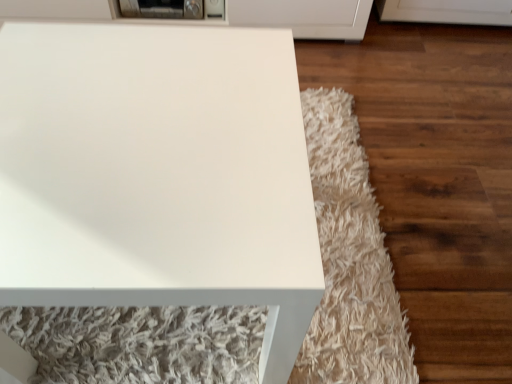
Describe the element at coordinates (157, 173) in the screenshot. The width and height of the screenshot is (512, 384). I see `white glossy table at center` at that location.

Image resolution: width=512 pixels, height=384 pixels. In order to click on white glossy table at center in this screenshot , I will do `click(157, 173)`.

Measure the distance between white glossy table at center and camera.

white glossy table at center is 19.07 inches from camera.

What do you see at coordinates (170, 9) in the screenshot? The width and height of the screenshot is (512, 384). I see `metallic gray toaster at upper center` at bounding box center [170, 9].

You are a GUI agent. You are given a task and a screenshot of the screen. Output one action in this format:
    pyautogui.click(x=<x>, y=<y>)
    Task: Click on the metallic gray toaster at upper center
    
    Given the screenshot: What is the action you would take?
    pyautogui.click(x=170, y=9)

You are a GUI agent. You are given a task and a screenshot of the screen. Output one action in this format:
    pyautogui.click(x=<x>, y=<y>)
    Task: Click on the white glossy table at center
    
    Given the screenshot: What is the action you would take?
    pyautogui.click(x=157, y=173)

Considering the positions of objects metallic gray toaster at upper center and white glossy table at center in the image provided, who is more to the right, metallic gray toaster at upper center or white glossy table at center?

white glossy table at center is more to the right.

Which object is closer to the camera taking this photo, metallic gray toaster at upper center or white glossy table at center?

Positioned in front is white glossy table at center.

Which is behind, point (139, 3) or point (104, 264)?

Positioned behind is point (139, 3).

From the image's perspective, is metallic gray toaster at upper center on white glossy table at center?

Indeed, from the image's perspective, metallic gray toaster at upper center is shown above white glossy table at center.

From a real-world perspective, is metallic gray toaster at upper center positioned over white glossy table at center based on gravity?

Actually, metallic gray toaster at upper center is physically below white glossy table at center in the real world.

Can you confirm if metallic gray toaster at upper center is thinner than white glossy table at center?

Correct, the width of metallic gray toaster at upper center is less than that of white glossy table at center.

Can you confirm if metallic gray toaster at upper center is shorter than white glossy table at center?

Correct, metallic gray toaster at upper center is not as tall as white glossy table at center.

Considering the sizes of objects metallic gray toaster at upper center and white glossy table at center in the image provided, who is smaller, metallic gray toaster at upper center or white glossy table at center?

With smaller size is metallic gray toaster at upper center.

Is metallic gray toaster at upper center spatially inside white glossy table at center, or outside of it?

metallic gray toaster at upper center is not inside white glossy table at center, it's outside.

Is metallic gray toaster at upper center positioned far away from white glossy table at center?

metallic gray toaster at upper center is near white glossy table at center, not far away.

Is metallic gray toaster at upper center aimed at white glossy table at center?

Yes, metallic gray toaster at upper center faces towards white glossy table at center.

What's the angular difference between metallic gray toaster at upper center and white glossy table at center's facing directions?

They differ by 0.262 degrees in their facing directions.

Measure the distance between metallic gray toaster at upper center and white glossy table at center.

The distance of metallic gray toaster at upper center from white glossy table at center is 37.24 inches.

The height and width of the screenshot is (384, 512). I want to click on table above the metallic gray toaster at upper center (from a real-world perspective), so click(x=157, y=173).

Is white glossy table at center to the right of metallic gray toaster at upper center from the viewer's perspective?

Correct, you'll find white glossy table at center to the right of metallic gray toaster at upper center.

Is white glossy table at center in front of metallic gray toaster at upper center?

Yes, white glossy table at center is closer to the viewer.

Considering the points (41, 198) and (136, 12), which point is behind, point (41, 198) or point (136, 12)?

The point (136, 12) is behind.

From the image's perspective, which is below, white glossy table at center or metallic gray toaster at upper center?

white glossy table at center appears lower in the image.

Based on the photo, from a real-world perspective, relative to metallic gray toaster at upper center, is white glossy table at center vertically above or below?

Clearly, from a real-world perspective, white glossy table at center is above metallic gray toaster at upper center.

Can you confirm if white glossy table at center is wider than metallic gray toaster at upper center?

Indeed, white glossy table at center has a greater width compared to metallic gray toaster at upper center.

Is white glossy table at center taller or shorter than metallic gray toaster at upper center?

white glossy table at center is taller than metallic gray toaster at upper center.

Considering the relative sizes of white glossy table at center and metallic gray toaster at upper center in the image provided, is white glossy table at center smaller than metallic gray toaster at upper center?

No, white glossy table at center is not smaller than metallic gray toaster at upper center.

Can we say white glossy table at center lies outside metallic gray toaster at upper center?

white glossy table at center lies outside metallic gray toaster at upper center's area.

Is white glossy table at center directly adjacent to metallic gray toaster at upper center?

No, white glossy table at center is not beside metallic gray toaster at upper center.

Is metallic gray toaster at upper center at the back of white glossy table at center?

Yes, white glossy table at center's orientation is away from metallic gray toaster at upper center.

Can you tell me how much white glossy table at center and metallic gray toaster at upper center differ in facing direction?

white glossy table at center and metallic gray toaster at upper center are facing 0.262 degrees away from each other.

Measure the distance from white glossy table at center to metallic gray toaster at upper center.

37.24 inches.

In the image, there is a metallic gray toaster at upper center. Where is `table below it (from the image's perspective)`? The width and height of the screenshot is (512, 384). table below it (from the image's perspective) is located at coordinates (157, 173).

Where is `appliance below the white glossy table at center (from a real-world perspective)`? This screenshot has width=512, height=384. appliance below the white glossy table at center (from a real-world perspective) is located at coordinates (170, 9).

This screenshot has height=384, width=512. I want to click on table that appears on the right of metallic gray toaster at upper center, so click(157, 173).